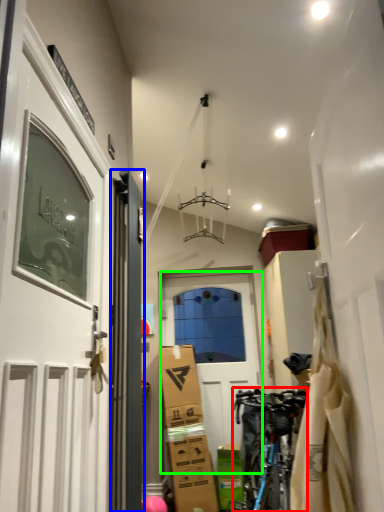
Question: Considering the real-world distances, which object is farthest from bicycle (highlighted by a red box)? door (highlighted by a blue box) or door (highlighted by a green box)?

Choices:
 (A) door
 (B) door

Answer: (A)